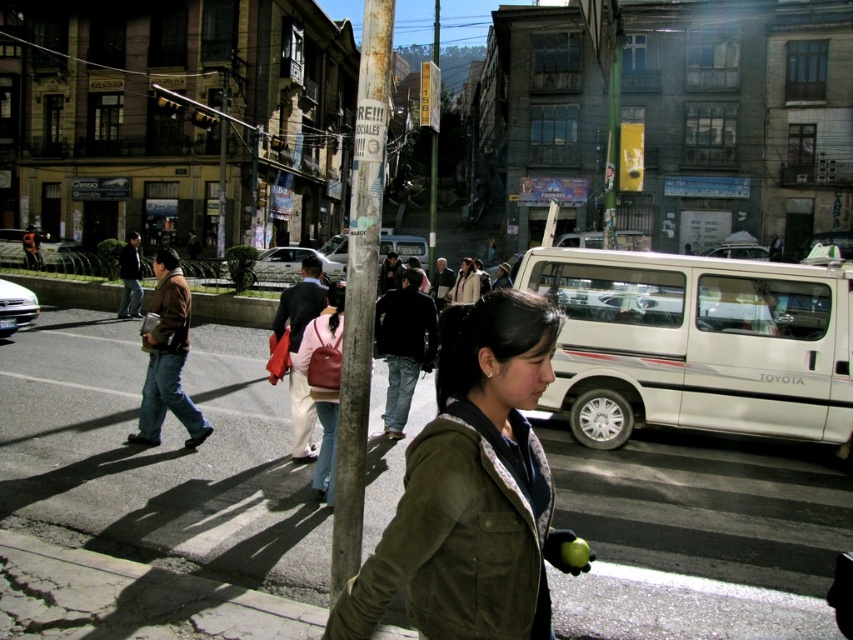
Is white metallic van at right closer to camera compared to brown leather jacket at left?

That is False.

Who is higher up, white metallic van at right or brown leather jacket at left?

brown leather jacket at left

Which is in front, point (711, 403) or point (134, 435)?

Point (134, 435)

The image size is (853, 640). Find the location of `white metallic van at right`. white metallic van at right is located at coordinates (697, 344).

Can you confirm if smooth asphalt road at center is positioned above white metallic van at right?

Incorrect, smooth asphalt road at center is not positioned above white metallic van at right.

Who is lower down, smooth asphalt road at center or white metallic van at right?

Positioned lower is smooth asphalt road at center.

Which is behind, point (62, 317) or point (625, 298)?

The point (62, 317) is more distant.

Identify the location of smooth asphalt road at center. (157, 456).

Does white metallic van at right have a greater height compared to green suede jacket at center?

Correct, white metallic van at right is much taller as green suede jacket at center.

Can you confirm if white metallic van at right is smaller than green suede jacket at center?

Actually, white metallic van at right might be larger than green suede jacket at center.

Find the location of a particular element. white metallic van at right is located at coordinates (697, 344).